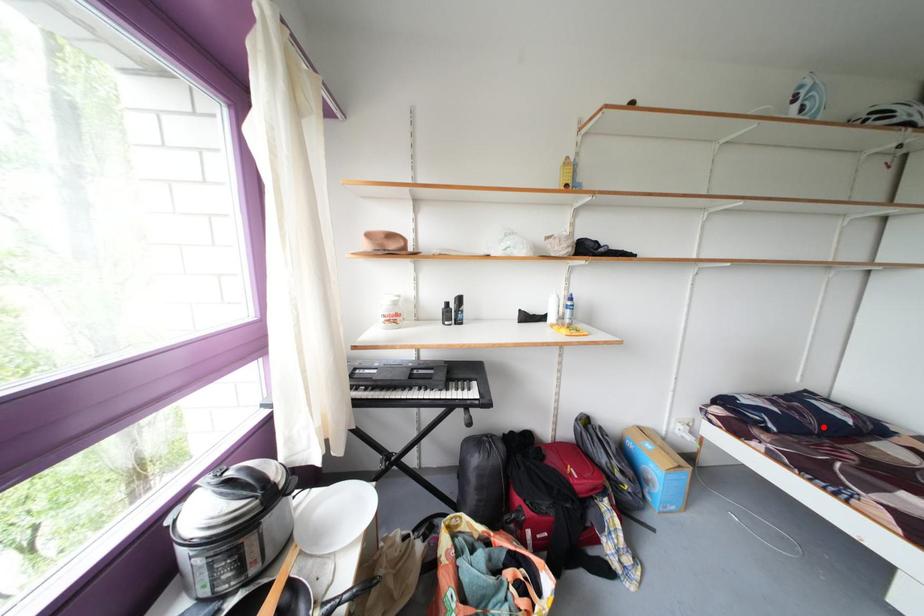
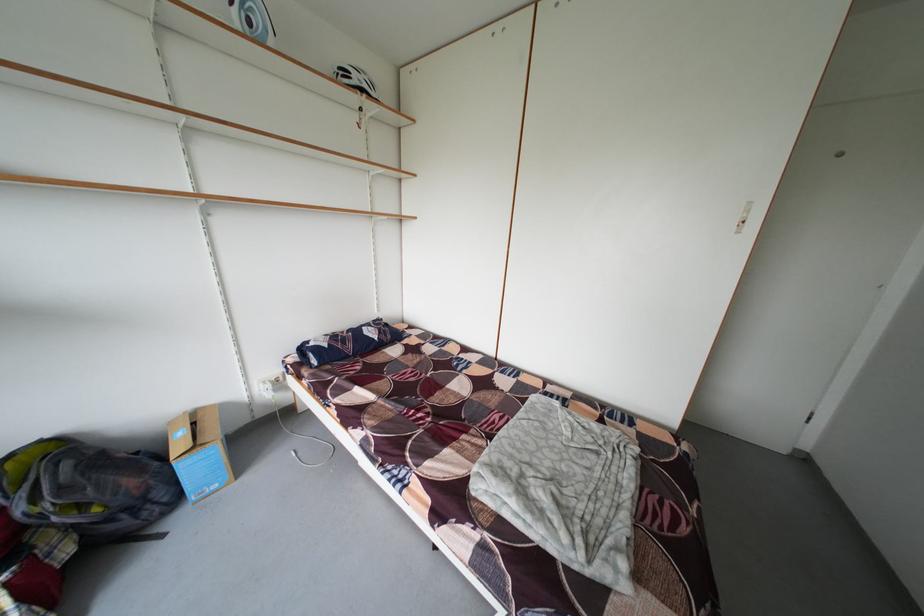
Question: I am providing you with two images of the same scene from different viewpoints. Image1 has a red point marked. In image2, the corresponding 3D location appears at what relative position? Reply with the corresponding letter.

Choices:
 (A) Closer
 (B) Farther

Answer: (B)